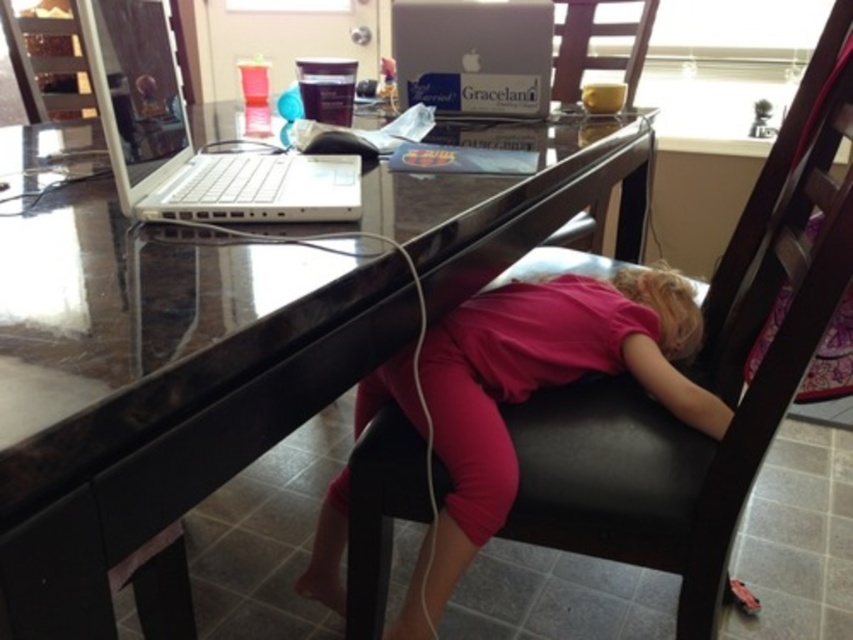
You are a delivery person entering the room and need to place a package on the glossy wood table at center. However, there is a white plastic laptop at upper left on the table. Can you place the package there without moving the laptop?

The glossy wood table at center is positioned under the white plastic laptop at upper left, so the laptop is not on the table. Therefore, you can place the package on the glossy wood table at center without moving the laptop.

You are a parent trying to ensure your child is sitting safely. The black leather chair at center and the pink matte shirt at center are in the scene. Which object is higher in height?

The black leather chair at center is much taller than the pink matte shirt at center, so the black leather chair at center is higher in height.

You are organizing a small party and need to place a decorative centerpiece on the glossy wood table at center. Considering the white plastic laptop at upper left is already on the table, will there be enough space for the centerpiece?

The glossy wood table at center has a larger size compared to the white plastic laptop at upper left, so there should be enough space to place the decorative centerpiece alongside the laptop.